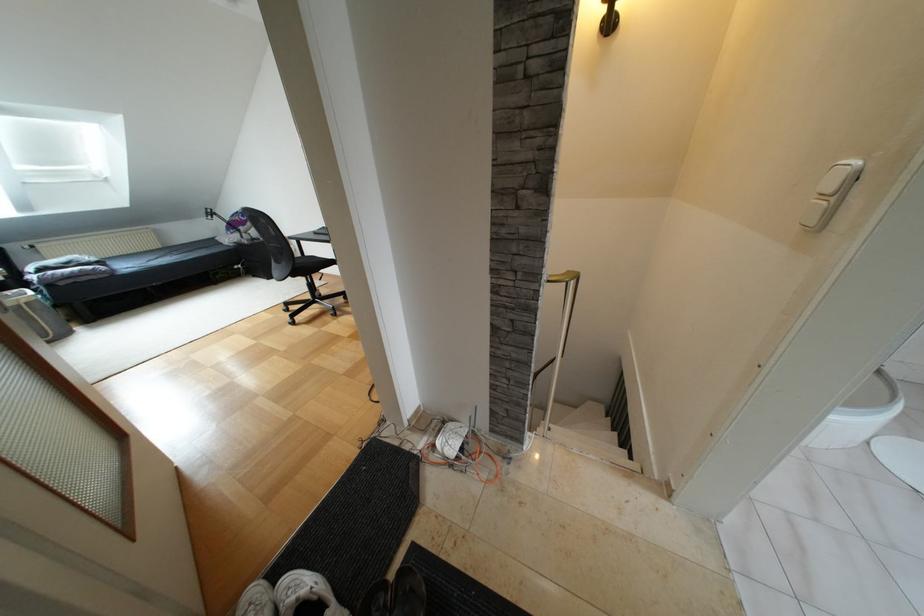
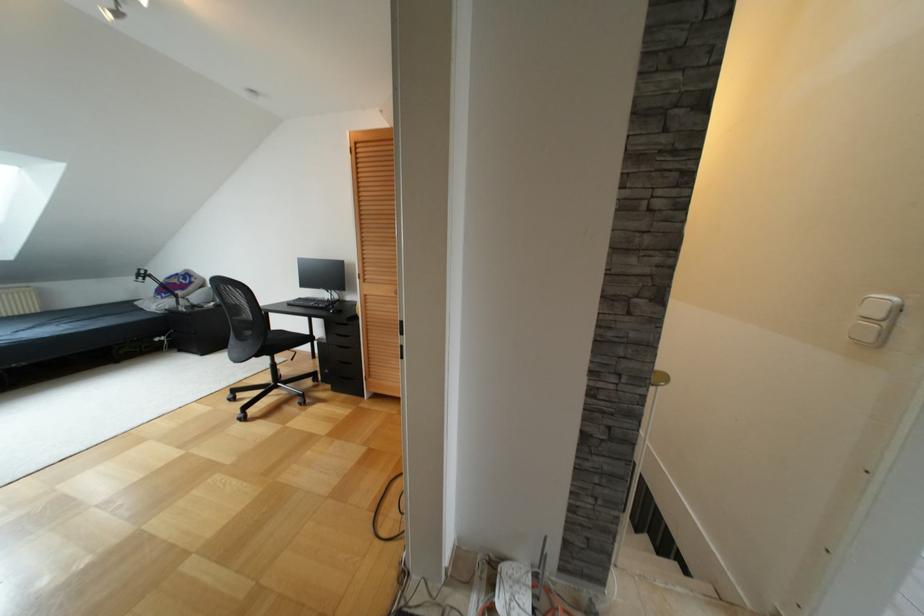
Question: Which direction would the cameraman need to move to produce the second image? Reply with the corresponding letter.

Choices:
 (A) Left
 (B) Right
 (C) Forward
 (D) Backward

Answer: (A)